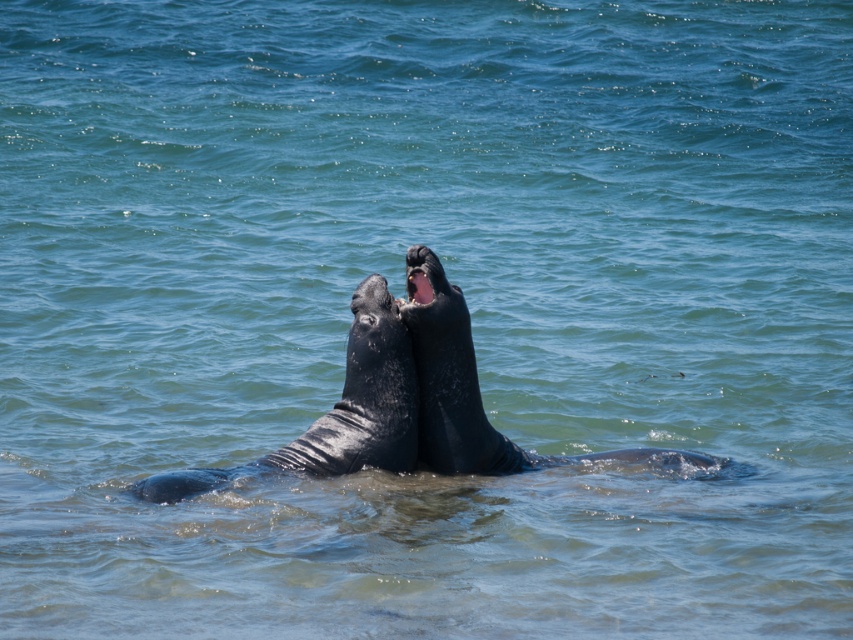
Can you confirm if shiny black whale at center is smaller than smooth dark gray whale at center?

Indeed, shiny black whale at center has a smaller size compared to smooth dark gray whale at center.

Between point (343, 392) and point (460, 356), which one is positioned behind?

Point (460, 356)

Between point (363, 378) and point (463, 404), which one is positioned in front?

Point (363, 378) is more forward.

The width and height of the screenshot is (853, 640). I want to click on shiny black whale at center, so click(x=338, y=410).